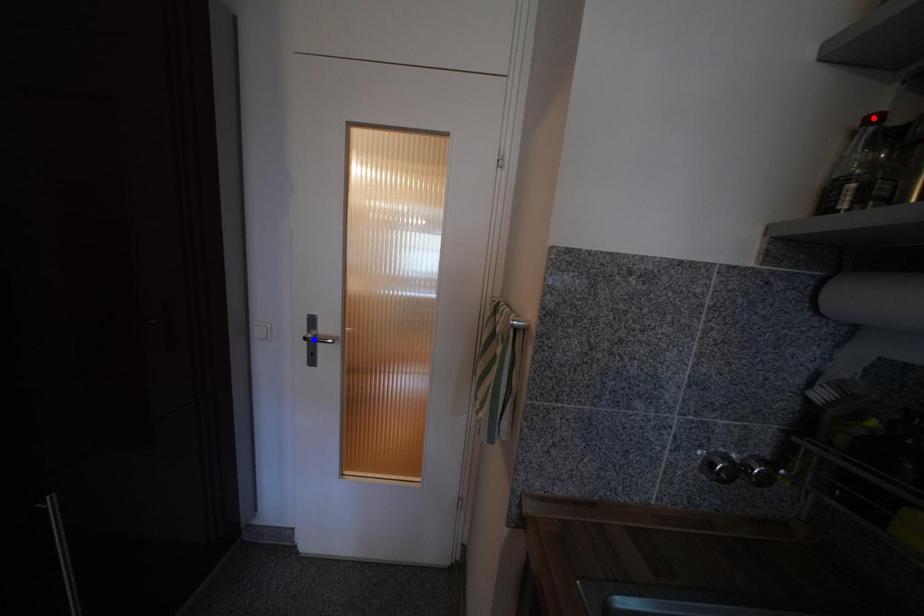
Question: Two points are marked on the image. Which point is closer to the camera?

Choices:
 (A) Blue point is closer.
 (B) Red point is closer.

Answer: (B)